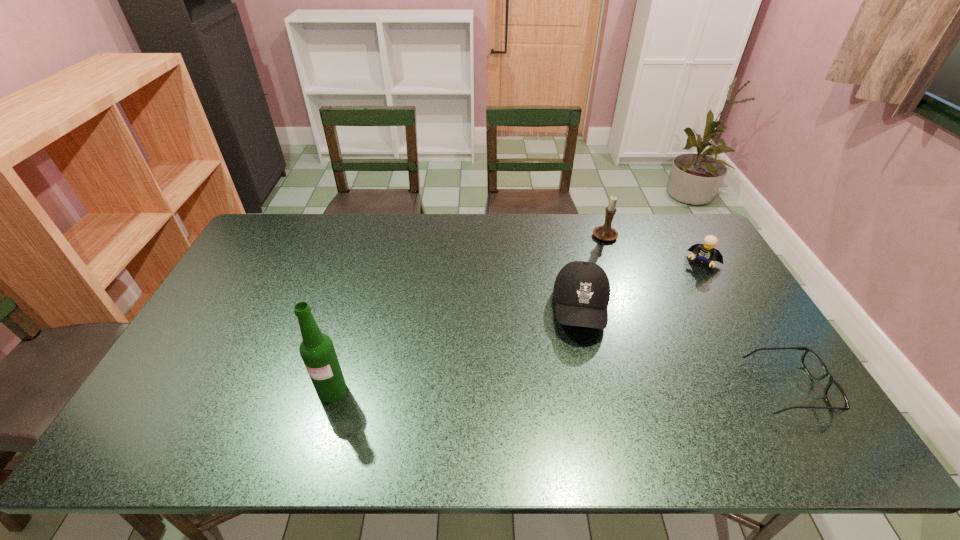
You are a GUI agent. You are given a task and a screenshot of the screen. Output one action in this format:
    pyautogui.click(x=<x>, y=<y>)
    Task: Click on the spectacles that is at the near edge
    This screenshot has width=960, height=540.
    Given the screenshot: What is the action you would take?
    pyautogui.click(x=835, y=397)

Identify the location of spectacles that is at the right edge. The image size is (960, 540). (835, 397).

You are a GUI agent. You are given a task and a screenshot of the screen. Output one action in this format:
    pyautogui.click(x=<x>, y=<y>)
    Task: Click on the Lego located at the right edge
    
    Given the screenshot: What is the action you would take?
    pyautogui.click(x=706, y=252)

Find the location of `object located at the far right corner`. object located at the far right corner is located at coordinates (706, 252).

This screenshot has height=540, width=960. What are the coordinates of `object located in the near right corner section of the desktop` in the screenshot? It's located at (835, 397).

This screenshot has width=960, height=540. What are the coordinates of `free space at the far edge` in the screenshot? It's located at (593, 224).

The height and width of the screenshot is (540, 960). What are the coordinates of `blank space at the right edge of the desktop` in the screenshot? It's located at (718, 298).

The height and width of the screenshot is (540, 960). Identify the location of free location at the far left corner. (289, 219).

This screenshot has height=540, width=960. What are the coordinates of `blank area at the far right corner` in the screenshot? It's located at (681, 223).

In the image, there is a desktop. Identify the location of vacant area at the near right corner. (749, 400).